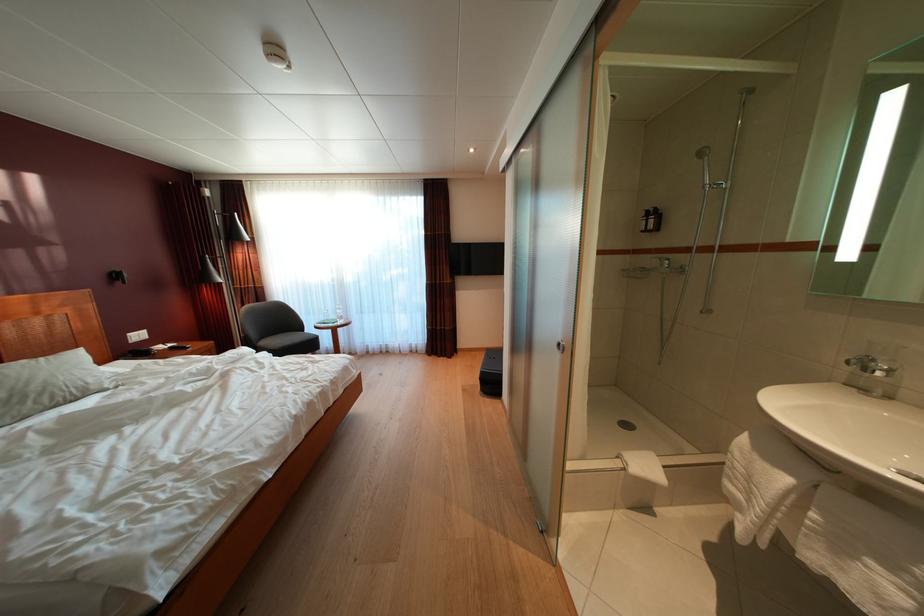
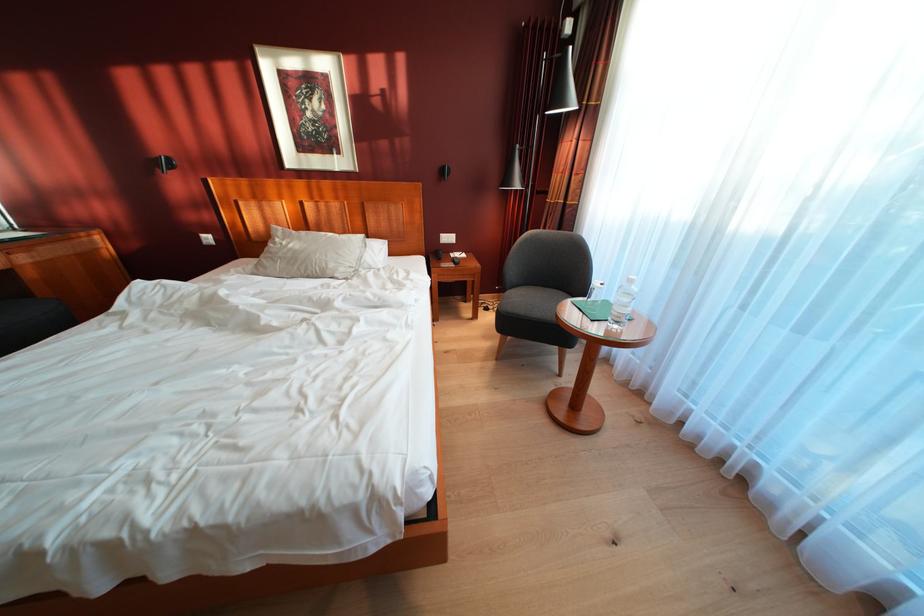
Question: I am providing you with two images of the same scene from different viewpoints. Please identify which objects are invisible in image2.

Choices:
 (A) white pillow
 (B) drinking glass
 (C) white light switch
 (D) none of these

Answer: (D)